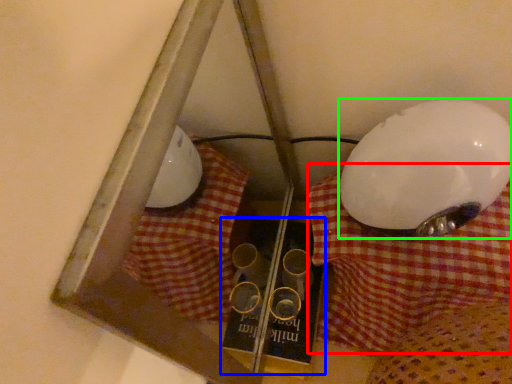
Question: Which object is positioned closest to tablecloth (highlighted by a red box)? Select from book (highlighted by a blue box) and lamp (highlighted by a green box).

Choices:
 (A) book
 (B) lamp

Answer: (B)